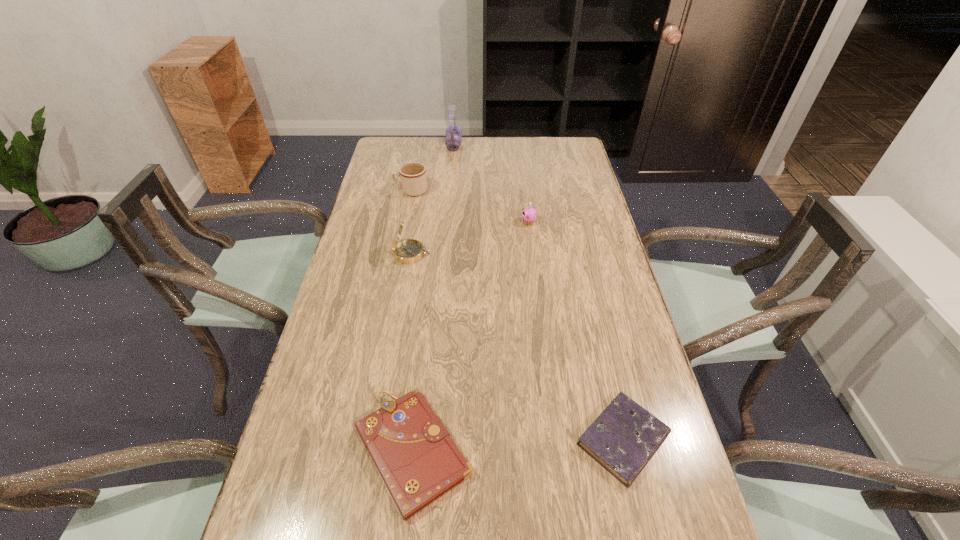
Identify the location of free space that satisfies the following two spatial constraints: 1. with the dial facing the fifth shortest object; 2. on the back side of the diary. (380, 440).